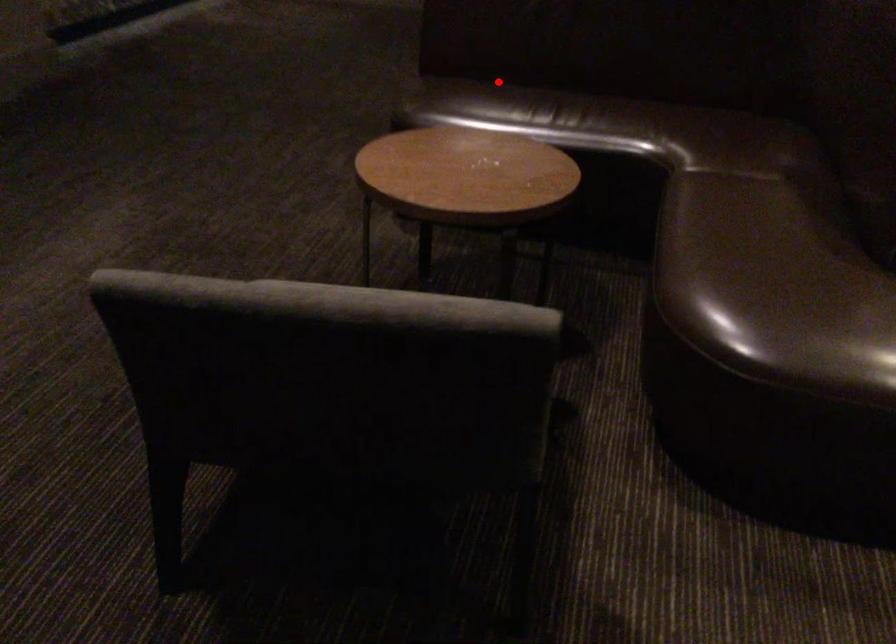
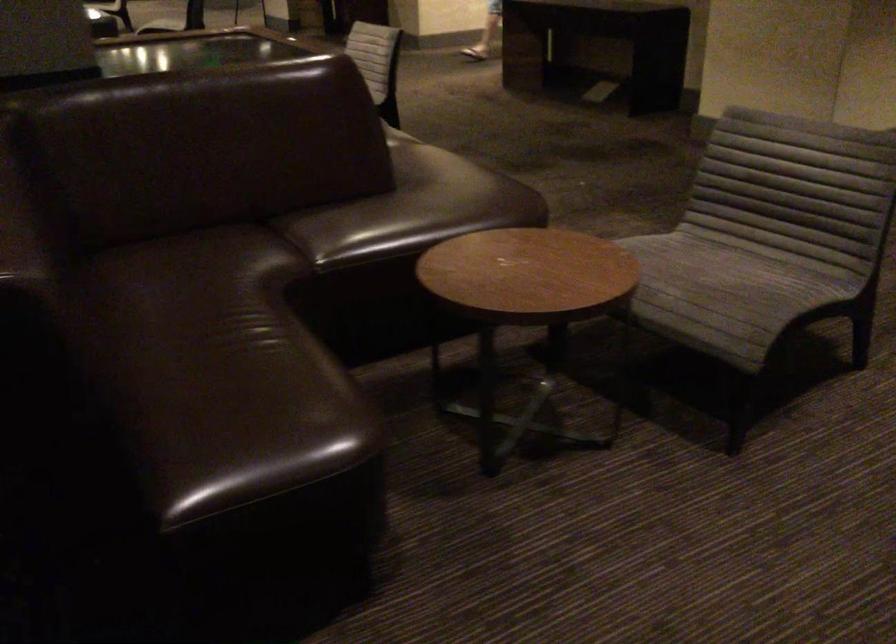
Question: I am providing you with two images of the same scene from different viewpoints. A red point is shown in image1. For the corresponding object point in image2, is it positioned nearer or farther from the camera?

Choices:
 (A) Nearer
 (B) Farther

Answer: (A)